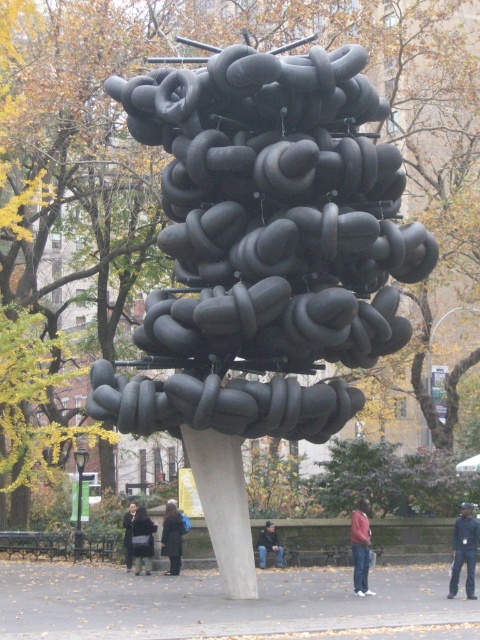
Looking at this image, who is positioned more to the right, black fabric coat at center or dark gray fabric jacket at center?

Positioned to the right is dark gray fabric jacket at center.

Which is more to the left, black fabric coat at center or dark gray fabric jacket at center?

From the viewer's perspective, black fabric coat at center appears more on the left side.

What do you see at coordinates (171, 538) in the screenshot? The image size is (480, 640). I see `black fabric coat at center` at bounding box center [171, 538].

Locate an element on the screen. black fabric coat at center is located at coordinates (171, 538).

Is black fabric coat at center closer to camera compared to dark gray coat at center?

That is True.

Does black fabric coat at center have a larger size compared to dark gray coat at center?

Incorrect, black fabric coat at center is not larger than dark gray coat at center.

Between point (175, 561) and point (128, 548), which one is positioned behind?

Point (128, 548)

Identify the location of black fabric coat at center. (171, 538).

Where is `dark blue jeans at lower right`? Image resolution: width=480 pixels, height=640 pixels. dark blue jeans at lower right is located at coordinates (464, 550).

Based on the photo, does dark blue jeans at lower right have a smaller size compared to dark gray fabric jacket at center?

No, dark blue jeans at lower right is not smaller than dark gray fabric jacket at center.

Is point (474, 552) in front of point (262, 548)?

Yes, it is.

This screenshot has height=640, width=480. What are the coordinates of `dark blue jeans at lower right` in the screenshot? It's located at 464,550.